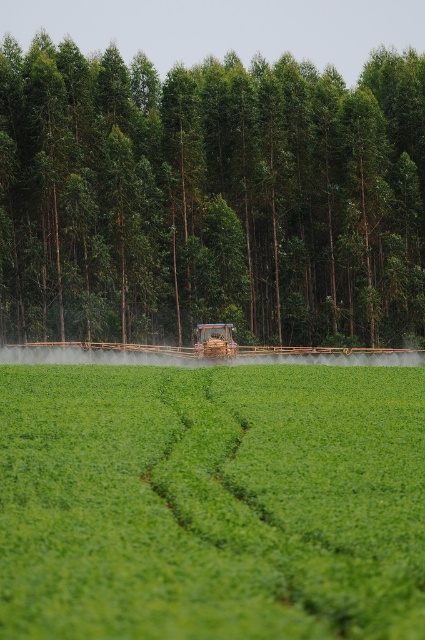
Question: Which object is positioned closest to the wooden brown tractor at center?

Choices:
 (A) green leafy field at center
 (B) green leafy tree at center

Answer: (B)

Question: Is green leafy tree at center closer to the viewer compared to green leafy field at center?

Choices:
 (A) no
 (B) yes

Answer: (A)

Question: Estimate the real-world distances between objects in this image. Which object is closer to the green leafy tree at center?

Choices:
 (A) wooden brown tractor at center
 (B) green leafy field at center

Answer: (A)

Question: Can you confirm if green leafy tree at center is positioned above green leafy field at center?

Choices:
 (A) no
 (B) yes

Answer: (B)

Question: From the image, what is the correct spatial relationship of green leafy field at center in relation to wooden brown tractor at center?

Choices:
 (A) above
 (B) below

Answer: (B)

Question: Which object appears closest to the camera in this image?

Choices:
 (A) green leafy field at center
 (B) wooden brown tractor at center

Answer: (A)